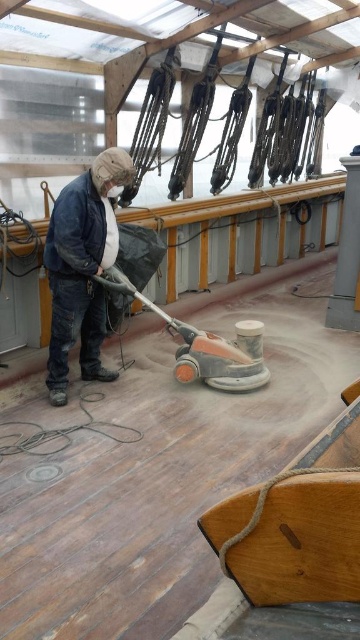
Who is more distant from viewer, (66, 326) or (142, 296)?

Positioned behind is point (142, 296).

Can you confirm if matte blue jacket at center is shorter than orange rubber floor sander at center?

No, matte blue jacket at center is not shorter than orange rubber floor sander at center.

Image resolution: width=360 pixels, height=640 pixels. What do you see at coordinates (83, 268) in the screenshot? I see `matte blue jacket at center` at bounding box center [83, 268].

Where is `matte blue jacket at center`? This screenshot has width=360, height=640. matte blue jacket at center is located at coordinates (83, 268).

Where is `brown polished wood at center`? This screenshot has width=360, height=640. brown polished wood at center is located at coordinates (164, 468).

Which of these two, brown polished wood at center or matte blue jacket at center, stands shorter?

brown polished wood at center

The width and height of the screenshot is (360, 640). What are the coordinates of `brown polished wood at center` in the screenshot? It's located at (164, 468).

Which is more to the right, brown polished wood at center or orange rubber floor sander at center?

From the viewer's perspective, orange rubber floor sander at center appears more on the right side.

Describe the element at coordinates (164, 468) in the screenshot. I see `brown polished wood at center` at that location.

Is point (123, 580) positioned after point (219, 385)?

No, (123, 580) is in front of (219, 385).

This screenshot has width=360, height=640. Find the location of `brown polished wood at center`. brown polished wood at center is located at coordinates (164, 468).